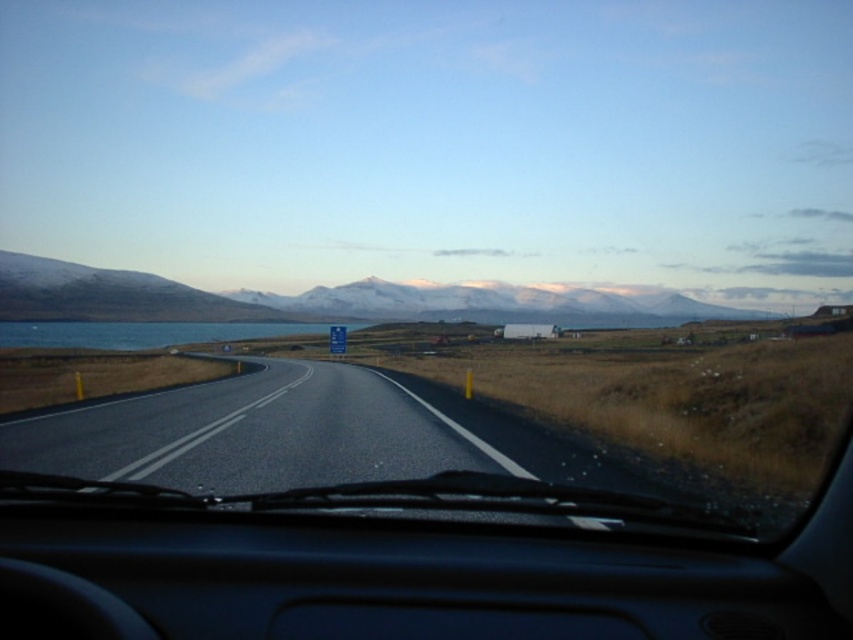
From the picture: You are sitting in the driver seat of the vehicle shown in the image. You notice two points on the road ahead. One is at coordinates point (691, 310) and the other at point (97, 323). Which point is closer to your current position?

Point (691, 310) is closer to your current position because it is further to the viewer than point (97, 323).

You are driving a car and looking through the windshield. You see a snowy mountain at center and a blue water at left. Which object is closer to you from your current position?

The blue water at left is closer to you than the snowy mountain at center because the snowy mountain at center is positioned over blue water at left, indicating it is further away in the background.

You are driving a car and want to know which object in the scene takes up more horizontal space in the windshield view. Based on the snowy mountain at center and blue water at left, which one is wider?

The snowy mountain at center is wider than the blue water at left.